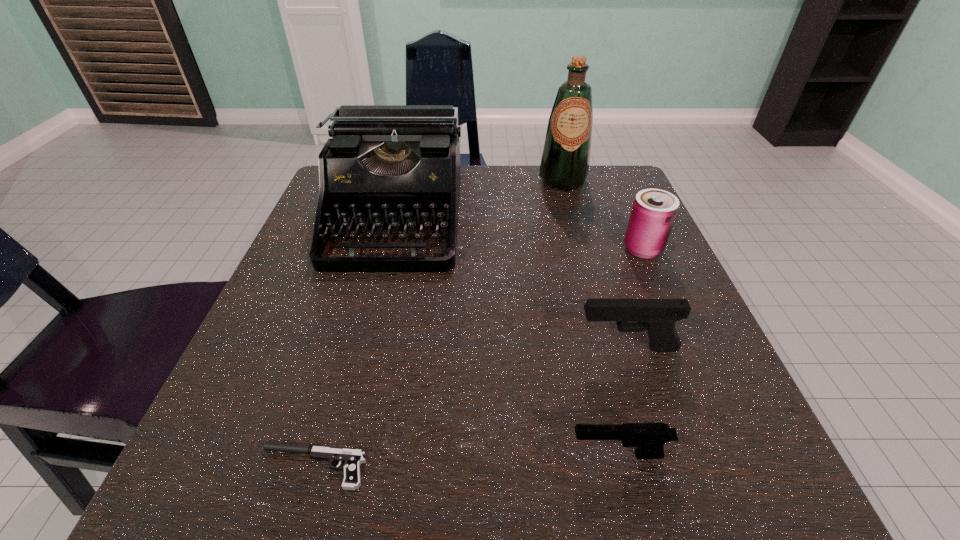
The image size is (960, 540). In order to click on vacant space that's between the typewriter and the second shortest pistol in this screenshot , I will do `click(506, 336)`.

What are the coordinates of `vacant space that's between the fifth shortest object and the olive oil` in the screenshot? It's located at pyautogui.click(x=478, y=199).

I want to click on vacant region between the second shortest object and the fifth shortest object, so click(506, 336).

You are a GUI agent. You are given a task and a screenshot of the screen. Output one action in this format:
    pyautogui.click(x=<x>, y=<y>)
    Task: Click on the object that is the second closest to the second tallest pistol
    The height and width of the screenshot is (540, 960).
    Given the screenshot: What is the action you would take?
    pyautogui.click(x=352, y=458)

Locate an element on the screen. the third closest object to the can is located at coordinates (389, 167).

Where is `pistol that is the second nearest to the second tallest pistol`? pistol that is the second nearest to the second tallest pistol is located at coordinates (352, 458).

Find the location of a particular element. The height and width of the screenshot is (540, 960). pistol that is the closest to the leftmost pistol is located at coordinates (649, 438).

The image size is (960, 540). Identify the location of free region that satisfies the following two spatial constraints: 1. on the front-facing side of the tallest object; 2. on the front-facing side of the leftmost pistol. [641, 467].

Locate an element on the screen. This screenshot has height=540, width=960. vacant space that satisfies the following two spatial constraints: 1. on the front-facing side of the can; 2. on the left side of the tallest object is located at coordinates [x=582, y=249].

Identify the location of vacant area that satisfies the following two spatial constraints: 1. on the typing side of the typewriter; 2. on the front-facing side of the shortest object. This screenshot has width=960, height=540. (330, 467).